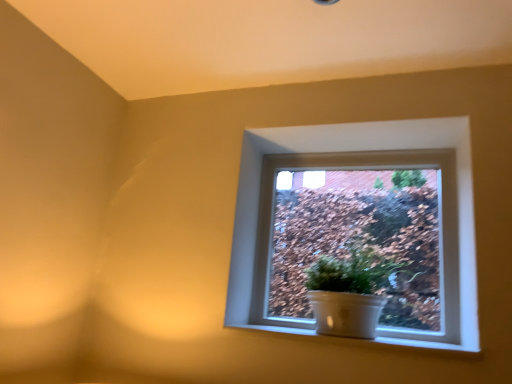
Question: Considering the relative positions of white ceramic pot at center and white glossy pot at center in the image provided, is white ceramic pot at center to the left or to the right of white glossy pot at center?

Choices:
 (A) right
 (B) left

Answer: (B)

Question: Considering the positions of white ceramic pot at center and white glossy pot at center in the image, is white ceramic pot at center wider or thinner than white glossy pot at center?

Choices:
 (A) wide
 (B) thin

Answer: (A)

Question: Which object is positioned farthest from the white ceramic at lower center?

Choices:
 (A) white glossy pot at center
 (B) white ceramic pot at center

Answer: (A)

Question: Considering the real-world distances, which object is closest to the white glossy pot at center?

Choices:
 (A) white ceramic pot at center
 (B) white ceramic at lower center

Answer: (A)